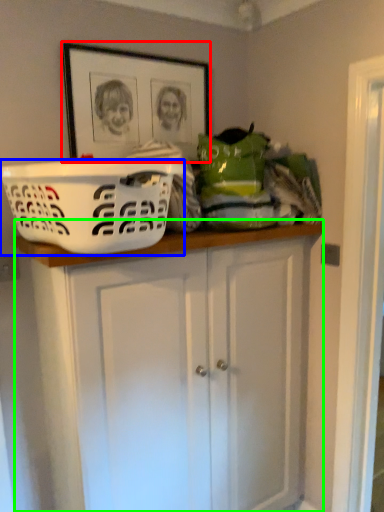
Question: Which is nearer to the picture frame (highlighted by a red box)? basket (highlighted by a blue box) or cabinetry (highlighted by a green box).

Choices:
 (A) basket
 (B) cabinetry

Answer: (A)